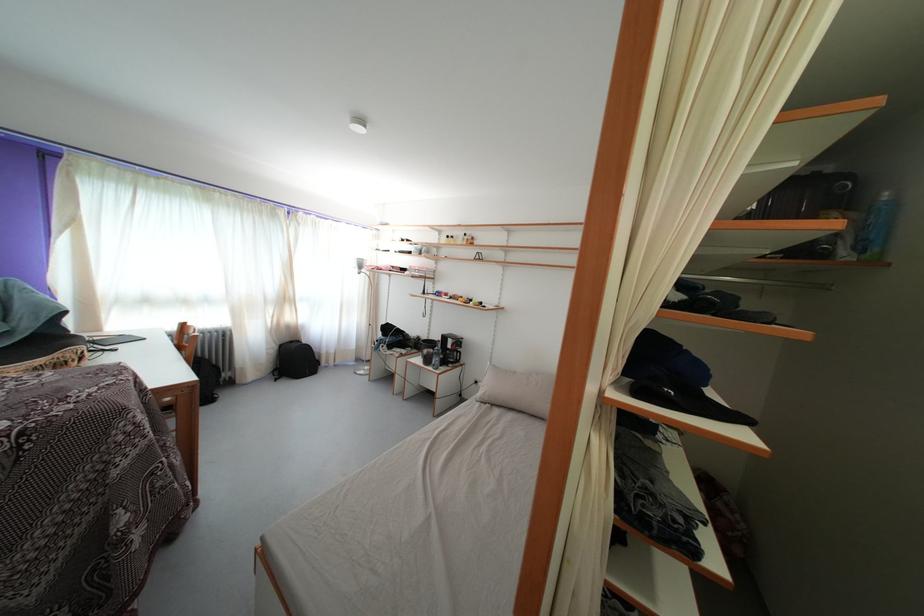
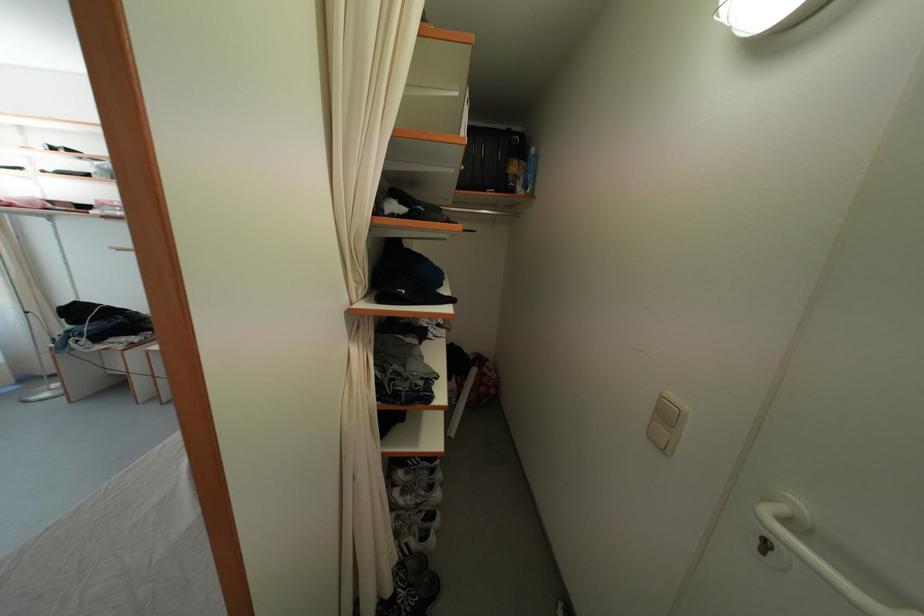
Find the pixel in the second image that matches the point at 849,257 in the first image.

(525, 195)